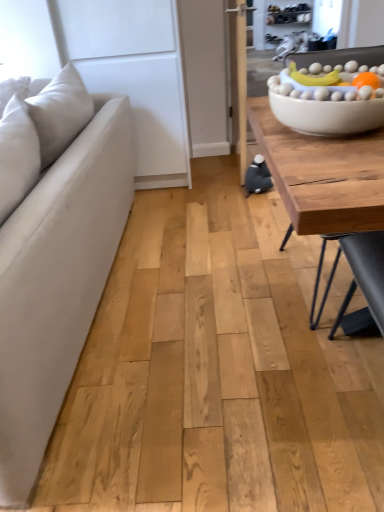
The height and width of the screenshot is (512, 384). Find the location of `suede beige couch at left`. suede beige couch at left is located at coordinates (54, 254).

Where is `white matte bowl at upper right`? The height and width of the screenshot is (512, 384). white matte bowl at upper right is located at coordinates (326, 116).

Is wooden table at right beside suede beige couch at left?

wooden table at right and suede beige couch at left are clearly separated.

Which of these two, wooden table at right or suede beige couch at left, is wider?

wooden table at right.

At what (x,y) coordinates should I click in order to perform the action: click on studio couch that appears in front of the wooden table at right. Please return your answer as a coordinate pair (x, y). Looking at the image, I should click on (54, 254).

Measure the distance from wooden table at right to suede beige couch at left.

The distance of wooden table at right from suede beige couch at left is 28.91 inches.

Identify the location of bowl above the suede beige couch at left (from a real-world perspective). The image size is (384, 512). (326, 116).

Looking at this image, is suede beige couch at left positioned far away from white matte bowl at upper right?

They are positioned close to each other.

Is suede beige couch at left further to camera compared to white matte bowl at upper right?

That is False.

From the image's perspective, is suede beige couch at left positioned above or below white matte bowl at upper right?

From the image's perspective, suede beige couch at left appears below white matte bowl at upper right.

Is white matte bowl at upper right further to the viewer compared to suede beige couch at left?

Yes, white matte bowl at upper right is further from the viewer.

Considering the sizes of objects white matte bowl at upper right and suede beige couch at left in the image provided, who is smaller, white matte bowl at upper right or suede beige couch at left?

white matte bowl at upper right.

Is white matte bowl at upper right not close to suede beige couch at left?

white matte bowl at upper right is actually quite close to suede beige couch at left.

Does white matte bowl at upper right have a lesser height compared to suede beige couch at left?

Yes, white matte bowl at upper right is shorter than suede beige couch at left.

Is wooden table at right in front of or behind white matte bowl at upper right in the image?

wooden table at right is behind white matte bowl at upper right.

Which of these two, wooden table at right or white matte bowl at upper right, is smaller?

With smaller size is white matte bowl at upper right.

Consider the image. In terms of height, does wooden table at right look taller or shorter compared to white matte bowl at upper right?

Considering their sizes, wooden table at right has more height than white matte bowl at upper right.

In the scene shown: Is wooden table at right wider than white matte bowl at upper right?

Correct, the width of wooden table at right exceeds that of white matte bowl at upper right.

From a real-world perspective, is suede beige couch at left physically located above or below wooden table at right?

In terms of real-world spatial position, suede beige couch at left is above wooden table at right.

Between suede beige couch at left and wooden table at right, which one has larger size?

suede beige couch at left.

How many degrees apart are the facing directions of suede beige couch at left and wooden table at right?

suede beige couch at left and wooden table at right are facing 93.7 degrees away from each other.

Based on the photo, considering the positions of objects suede beige couch at left and wooden table at right in the image provided, who is more to the right, suede beige couch at left or wooden table at right?

wooden table at right.

Does white matte bowl at upper right have a lesser width compared to wooden table at right?

Indeed, white matte bowl at upper right has a lesser width compared to wooden table at right.

Can you tell me how much white matte bowl at upper right and wooden table at right differ in facing direction?

85.4 degrees.

Does white matte bowl at upper right have a greater height compared to wooden table at right?

No.

Where is `coffee table lying on the right of suede beige couch at left`? The image size is (384, 512). coffee table lying on the right of suede beige couch at left is located at coordinates (323, 175).

There is a suede beige couch at left. Where is `bowl above it (from a real-world perspective)`? bowl above it (from a real-world perspective) is located at coordinates (326, 116).

From the image, which object appears to be farther from white matte bowl at upper right, wooden table at right or suede beige couch at left?

suede beige couch at left is further to white matte bowl at upper right.

Estimate the real-world distances between objects in this image. Which object is further from suede beige couch at left, wooden table at right or white matte bowl at upper right?

Based on the image, white matte bowl at upper right appears to be further to suede beige couch at left.

When comparing their distances from wooden table at right, does white matte bowl at upper right or suede beige couch at left seem further?

The object further to wooden table at right is suede beige couch at left.

Which object lies nearer to the anchor point wooden table at right, suede beige couch at left or white matte bowl at upper right?

white matte bowl at upper right is closer to wooden table at right.

Looking at the image, which one is located further to suede beige couch at left, white matte bowl at upper right or wooden table at right?

The object further to suede beige couch at left is white matte bowl at upper right.

Considering their positions, is suede beige couch at left positioned further to white matte bowl at upper right than wooden table at right?

suede beige couch at left.

Identify the location of bowl between suede beige couch at left and wooden table at right in the horizontal direction. The width and height of the screenshot is (384, 512). (326, 116).